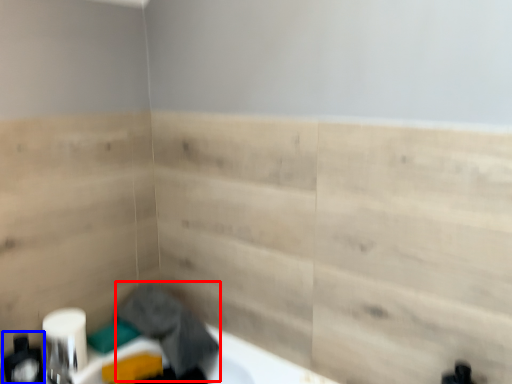
Question: Among these objects, which one is nearest to the camera, laundry (highlighted by a red box) or toiletry (highlighted by a blue box)?

Choices:
 (A) laundry
 (B) toiletry

Answer: (B)